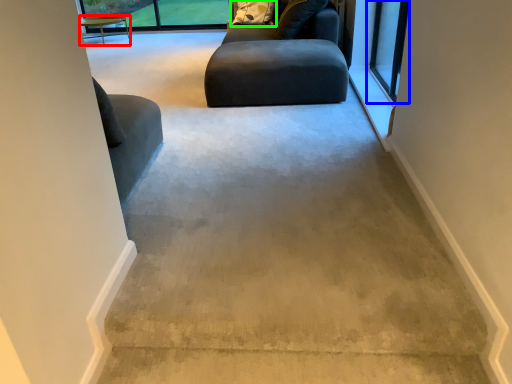
Question: Which is farther away from table (highlighted by a red box)? window (highlighted by a blue box) or pillow (highlighted by a green box)?

Choices:
 (A) window
 (B) pillow

Answer: (A)